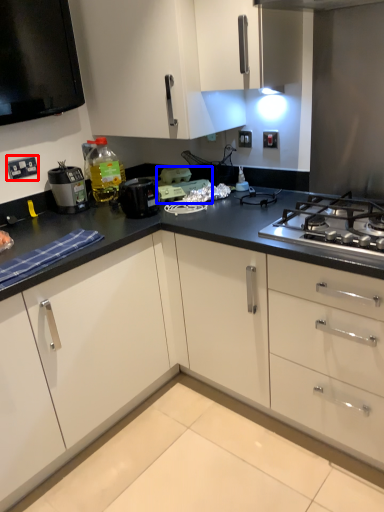
Question: Which object is further to the camera taking this photo, electric outlet (highlighted by a red box) or appliance (highlighted by a blue box)?

Choices:
 (A) electric outlet
 (B) appliance

Answer: (B)